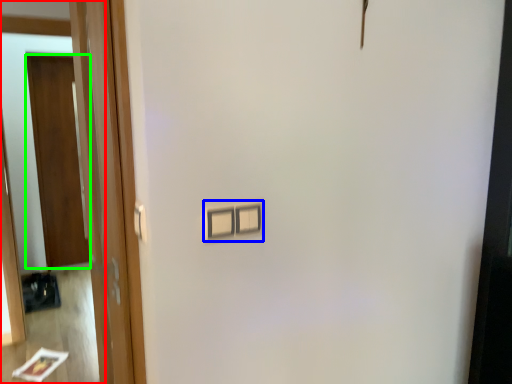
Question: Which is farther away from mirror (highlighted by a red box)? light switch (highlighted by a blue box) or door (highlighted by a green box)?

Choices:
 (A) light switch
 (B) door

Answer: (A)